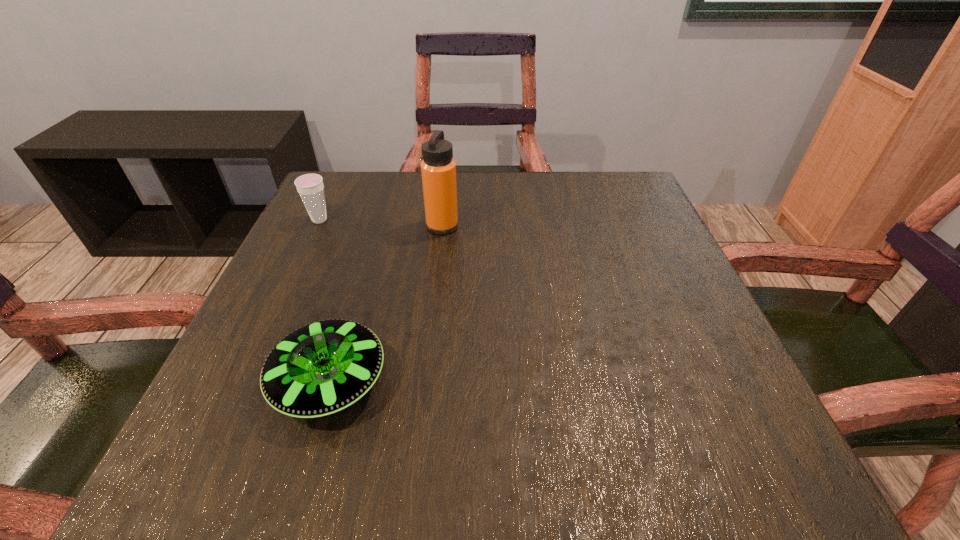
This screenshot has height=540, width=960. Identify the location of thermos bottle. (438, 168).

This screenshot has height=540, width=960. In order to click on the tallest object in this screenshot , I will do `click(438, 168)`.

You are a GUI agent. You are given a task and a screenshot of the screen. Output one action in this format:
    pyautogui.click(x=<x>, y=<y>)
    Task: Click on the leftmost object
    The width and height of the screenshot is (960, 540).
    Given the screenshot: What is the action you would take?
    pyautogui.click(x=310, y=187)

The width and height of the screenshot is (960, 540). Find the location of `the shortest object`. the shortest object is located at coordinates (324, 367).

Identify the location of saucer. (324, 367).

At what (x,y) coordinates should I click in order to perform the action: click on vacant point located on the right of the rightmost object. Please return your answer as a coordinate pair (x, y). This screenshot has width=960, height=540. Looking at the image, I should click on (526, 226).

Find the location of a particular element. The width and height of the screenshot is (960, 540). free space located on the back of the cup is located at coordinates (341, 174).

Identify the location of free region located on the front of the second object from left to right. The height and width of the screenshot is (540, 960). (301, 478).

The height and width of the screenshot is (540, 960). Identify the location of thermos bottle at the far edge. (438, 168).

Image resolution: width=960 pixels, height=540 pixels. I want to click on cup present at the far edge, so click(x=310, y=187).